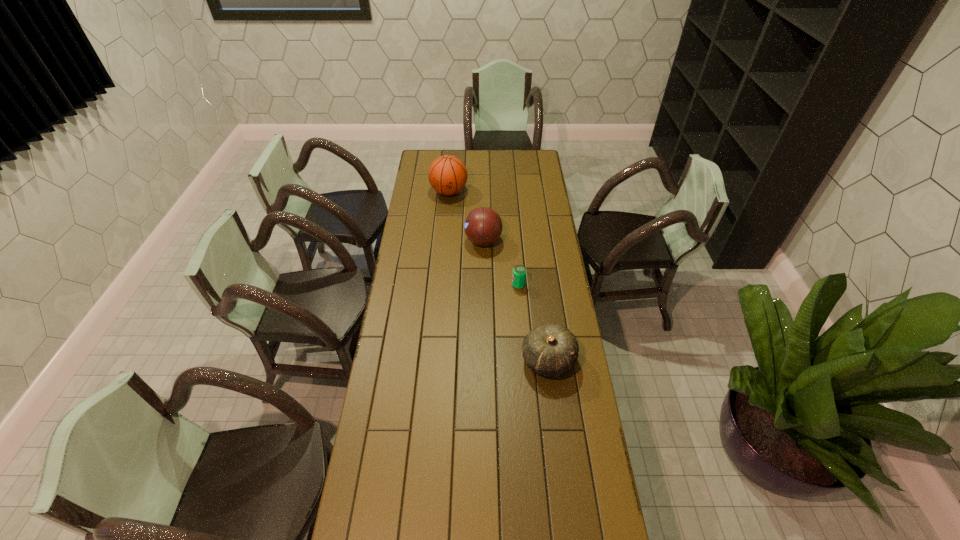
Locate an element on the screen. The image size is (960, 540). free space located 0.370m on the front-facing side of the shortest object is located at coordinates (430, 285).

Image resolution: width=960 pixels, height=540 pixels. Find the location of `vacant space located 0.200m on the front-facing side of the shortest object`. vacant space located 0.200m on the front-facing side of the shortest object is located at coordinates (468, 285).

Image resolution: width=960 pixels, height=540 pixels. What are the coordinates of `free region located on the front-facing side of the shortest object` in the screenshot? It's located at (445, 285).

The height and width of the screenshot is (540, 960). Find the location of `object positioned at the left edge`. object positioned at the left edge is located at coordinates click(x=447, y=175).

You are a GUI agent. You are given a task and a screenshot of the screen. Output one action in this format:
    pyautogui.click(x=<x>, y=<y>)
    Task: Click on the object present at the right edge
    The width and height of the screenshot is (960, 540).
    Given the screenshot: What is the action you would take?
    pyautogui.click(x=551, y=350)

Image resolution: width=960 pixels, height=540 pixels. What are the coordinates of `free space at the far edge of the desktop` in the screenshot? It's located at (486, 168).

The image size is (960, 540). I want to click on free space at the left edge of the desktop, so click(x=412, y=358).

Find the location of a particular element. vacant point at the right edge is located at coordinates (599, 497).

This screenshot has width=960, height=540. Find the location of `free space at the far right corner of the desktop`. free space at the far right corner of the desktop is located at coordinates (522, 153).

Find the location of a particular element. free space between the third tallest object and the nearer basketball is located at coordinates (516, 301).